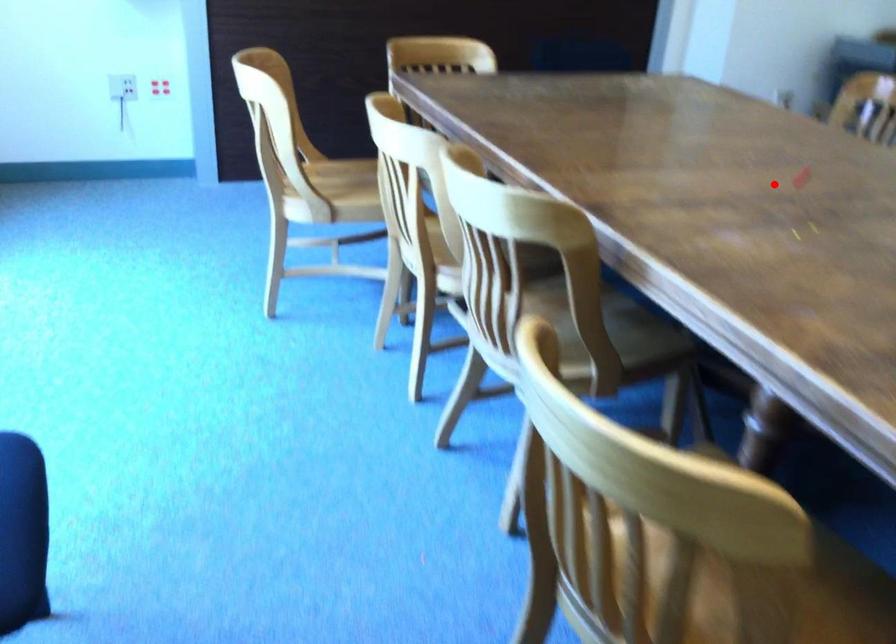
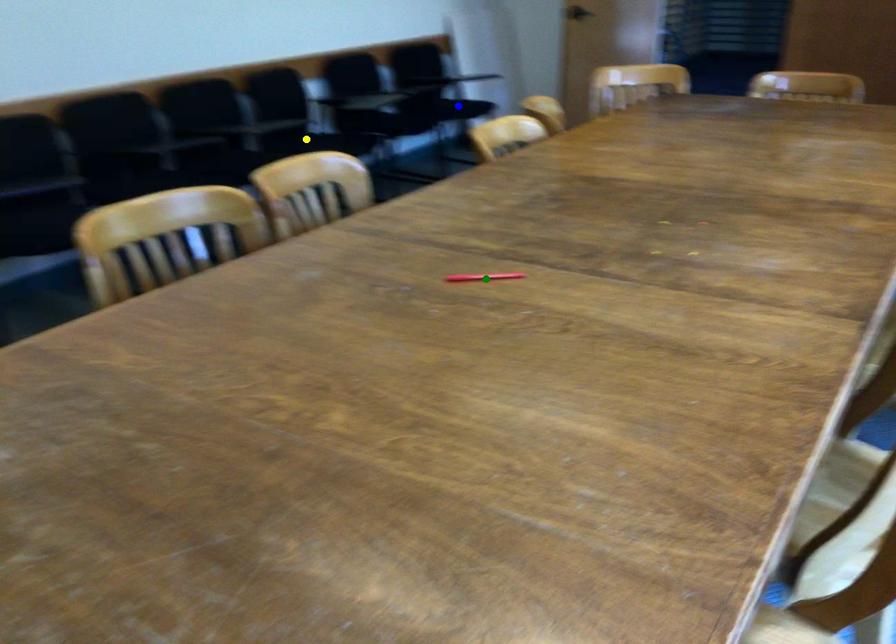
Question: I am providing you with two images of the same scene from different viewpoints. A red point is marked on the first image. You are given multiple points on the second image. Which spot in image 2 lines up with the point in image 1?

Choices:
 (A) blue point
 (B) yellow point
 (C) green point

Answer: (C)